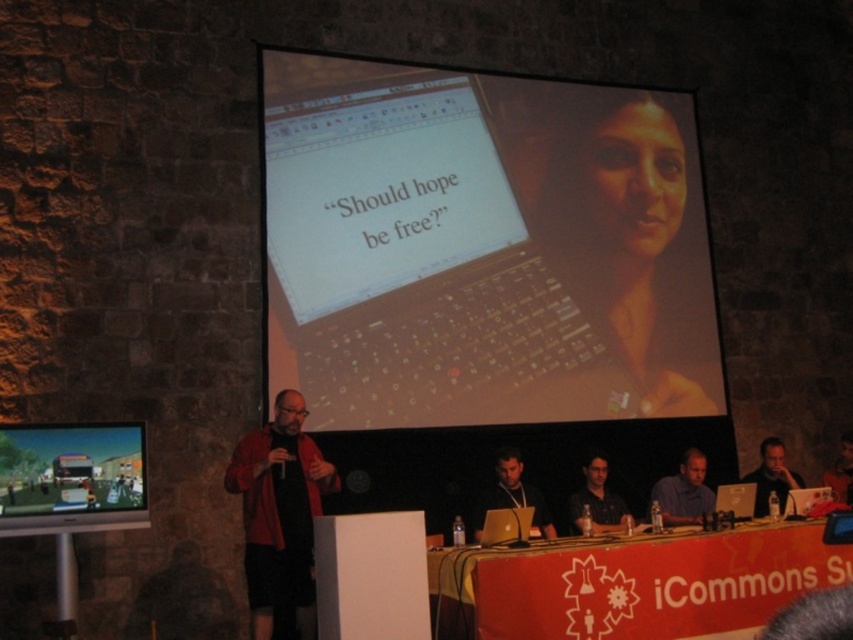
Question: Which point is closer to the camera?

Choices:
 (A) (270, 586)
 (B) (515, 612)
 (C) (315, 280)

Answer: (B)

Question: Considering the real-world distances, which object is farthest from the dark red fabric jacket at left?

Choices:
 (A) dark hair at lower right
 (B) silver metallic laptop at center
 (C) dark brown leather jacket at upper center

Answer: (C)

Question: Which object appears closest to the camera in this image?

Choices:
 (A) red fabric banner at lower center
 (B) dark brown leather jacket at upper center
 (C) dark hair at center

Answer: (A)

Question: Is dark gray shirt at center above dark brown leather jacket at upper center?

Choices:
 (A) yes
 (B) no

Answer: (B)

Question: Can you confirm if blue shirt at center is positioned to the right of silver metallic laptop at center?

Choices:
 (A) yes
 (B) no

Answer: (B)

Question: Does blue shirt at center appear on the left side of silver metallic laptop at center?

Choices:
 (A) no
 (B) yes

Answer: (B)